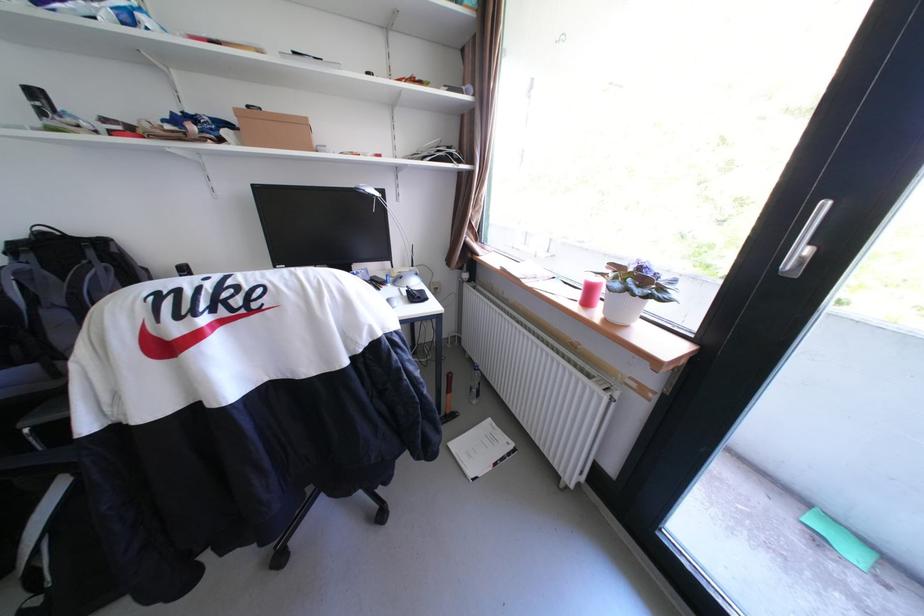
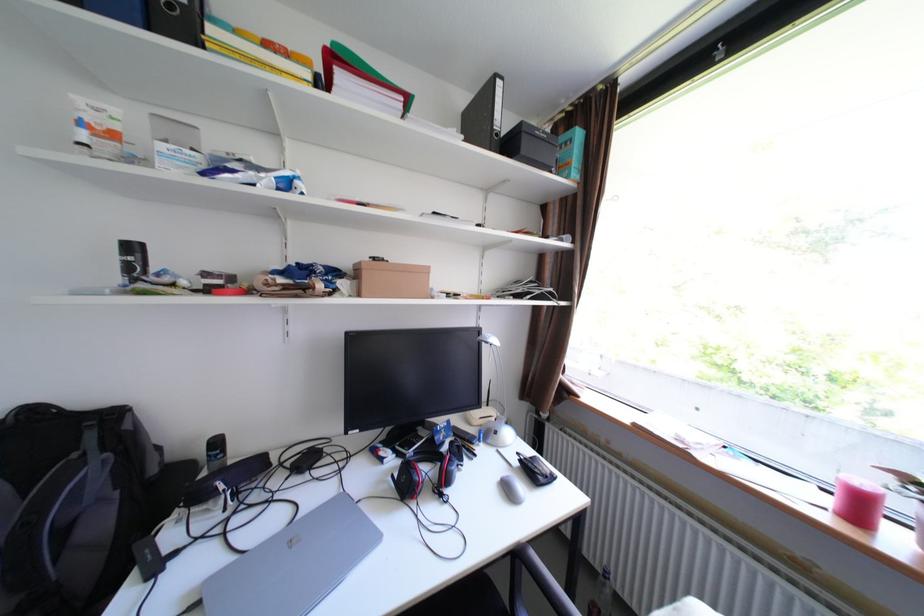
In the second image, find the point that corresponds to [47,95] in the first image.

(143, 248)